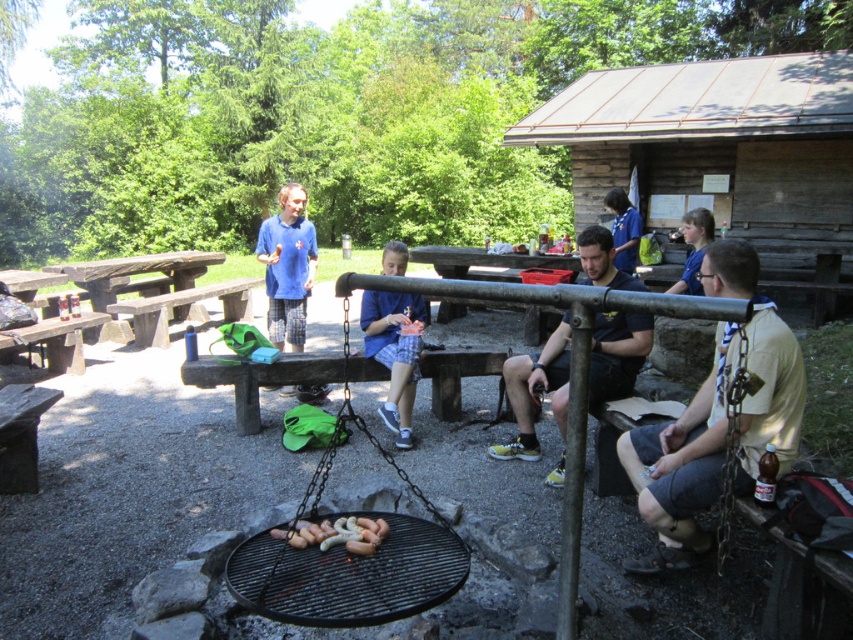
Question: Observing the image, what is the correct spatial positioning of metallic silver water at center in reference to grilled sausages at center?

Choices:
 (A) left
 (B) right

Answer: (B)

Question: Where is weathered wood cabin at upper right located in relation to black matte grill at center in the image?

Choices:
 (A) right
 (B) left

Answer: (A)

Question: Which object appears farthest from the camera in this image?

Choices:
 (A) metallic silver water at center
 (B) tan fabric shirt at center
 (C) weathered wood cabin at upper right
 (D) blue fabric at center

Answer: (C)

Question: Which point is farther to the camera?

Choices:
 (A) tan fabric shirt at center
 (B) weathered wood cabin at upper right
 (C) grilled sausages at center
 (D) black matte grill at center

Answer: (B)

Question: Which object is the farthest from the blue fabric at center?

Choices:
 (A) black matte grill at center
 (B) grilled sausages at center
 (C) metallic silver water at center

Answer: (A)

Question: Where is weathered wood cabin at upper right located in relation to metallic silver water at center in the image?

Choices:
 (A) above
 (B) below

Answer: (A)